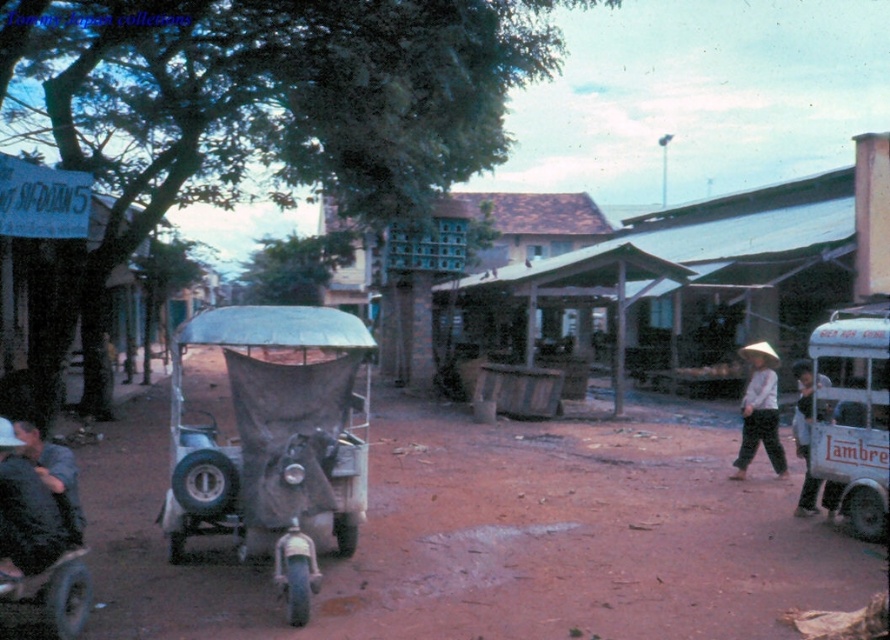
Question: Which point is closer to the camera taking this photo?

Choices:
 (A) (818, 419)
 (B) (476, 204)
 (C) (799, 396)

Answer: (A)

Question: In this image, where is wooden hut at center located relative to white woven hat at right?

Choices:
 (A) right
 (B) left

Answer: (B)

Question: Can you confirm if metallic silver cart at right is positioned below dark blue shirt at lower left?

Choices:
 (A) yes
 (B) no

Answer: (B)

Question: Does dark gray canvas cart at center appear under white woven hat at right?

Choices:
 (A) yes
 (B) no

Answer: (A)

Question: Among these points, which one is nearest to the camera?

Choices:
 (A) (326, 204)
 (B) (754, 384)

Answer: (B)

Question: Considering the real-world distances, which object is closest to the metallic silver cart at right?

Choices:
 (A) white cloth hat at right
 (B) white woven hat at right
 (C) wooden hut at center
 (D) dark blue shirt at lower left

Answer: (B)